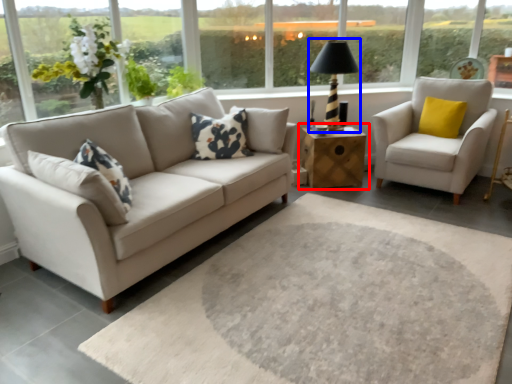
Question: Which object appears farthest to the camera in this image, table (highlighted by a red box) or table lamp (highlighted by a blue box)?

Choices:
 (A) table
 (B) table lamp

Answer: (A)